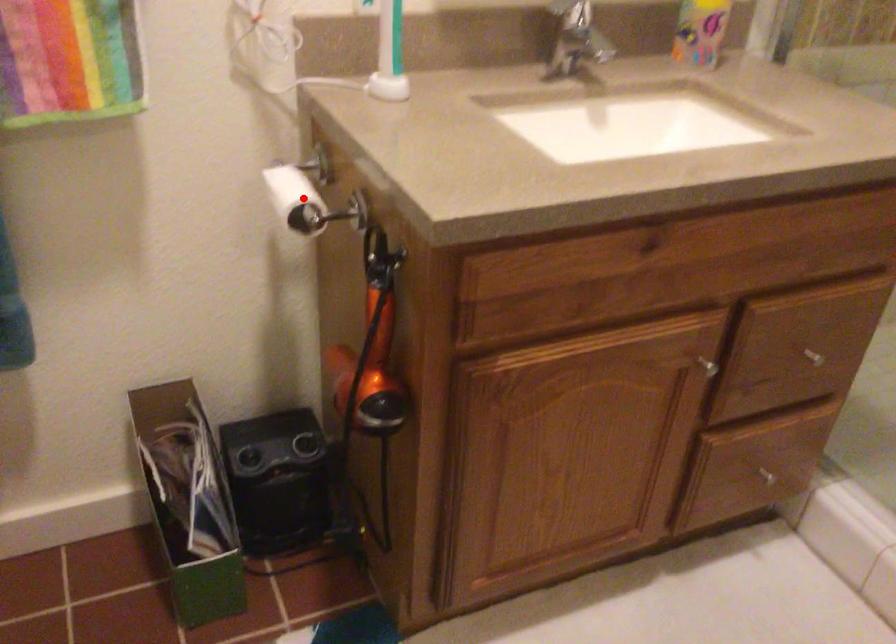
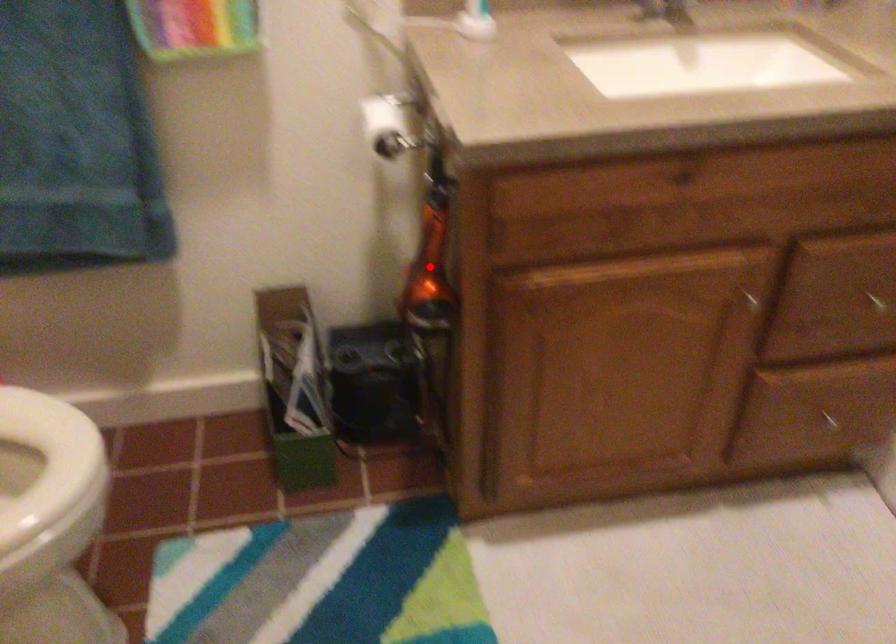
I am providing you with two images of the same scene from different viewpoints. A red point is marked on the first image and another point is marked on the second image. Is the red point in image1 aligned with the point shown in image2?

No